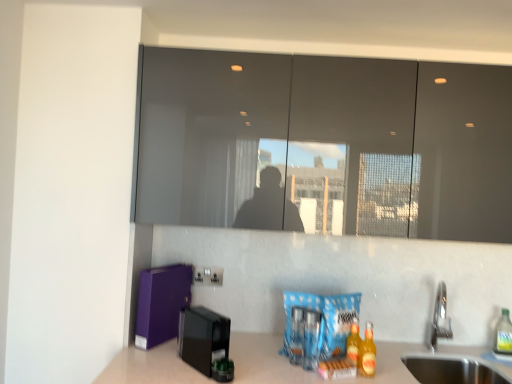
Question: From the image's perspective, is clear plastic bottle at lower right, the third beverage in the left-to-right sequence, located above or below black plastic coffee machine at lower left?

Choices:
 (A) below
 (B) above

Answer: (A)

Question: Is clear plastic bottle at lower right, which is counted as the first beverage, starting from the back, taller or shorter than black plastic coffee machine at lower left?

Choices:
 (A) tall
 (B) short

Answer: (B)

Question: Estimate the real-world distances between objects in this image. Which object is farther from the clear plastic bottle at lower right, placed as the 1th beverage when sorted from right to left?

Choices:
 (A) stainless steel sink at lower right, which ranks as the 2th sink in top-to-bottom order
 (B) matte gray mirror at upper center
 (C) translucent plastic bottle at center, the first beverage when ordered from left to right
 (D) silver metallic sink at lower right, the 1th sink from the top
 (E) black plastic coffee machine at lower left

Answer: (E)

Question: Which object is positioned closest to the translucent glass bottles at lower right, which is counted as the third beverage, starting from the back?

Choices:
 (A) translucent plastic bottle at center, which is counted as the second beverage, starting from the back
 (B) clear plastic bottle at lower right, placed as the 1th beverage when sorted from right to left
 (C) matte gray mirror at upper center
 (D) stainless steel sink at lower right, which ranks as the 2th sink in top-to-bottom order
 (E) silver metallic sink at lower right, acting as the second sink starting from the bottom

Answer: (A)